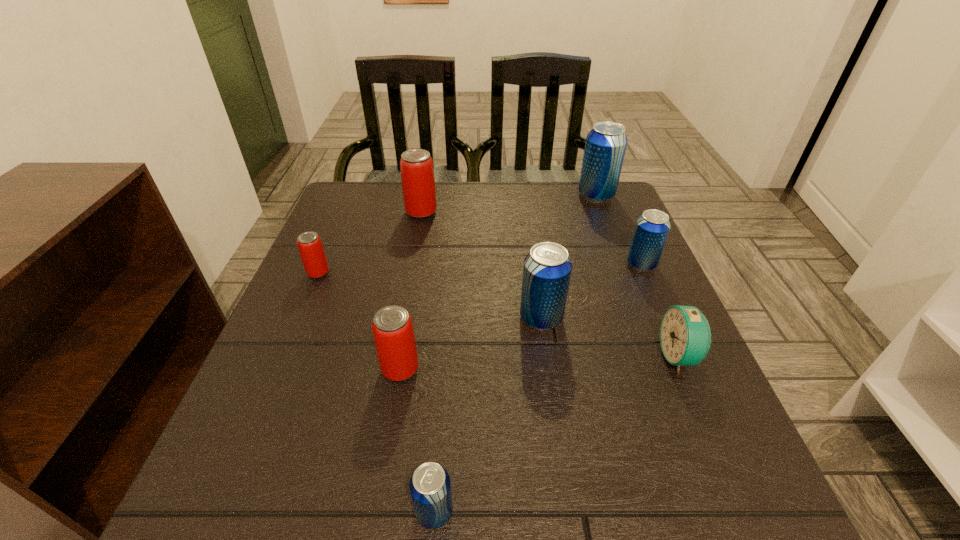
Where is `the leftmost beer can`? the leftmost beer can is located at coordinates (311, 250).

The height and width of the screenshot is (540, 960). Find the location of `the fifth object from right to left`. the fifth object from right to left is located at coordinates (430, 487).

Locate an element on the screen. This screenshot has width=960, height=540. the smallest blue beer can is located at coordinates (430, 487).

Locate an element on the screen. Image resolution: width=960 pixels, height=540 pixels. vacant position located 0.200m on the front of the farthest blue beer can is located at coordinates [617, 250].

The width and height of the screenshot is (960, 540). Find the location of `free space located 0.260m on the front of the biggest pink beer can`. free space located 0.260m on the front of the biggest pink beer can is located at coordinates (407, 288).

At what (x,y) coordinates should I click in order to perform the action: click on free spot located on the back of the fifth object from left to right. Please return your answer as a coordinate pair (x, y). Looking at the image, I should click on (527, 222).

The width and height of the screenshot is (960, 540). I want to click on free region located 0.140m on the back of the third biggest blue beer can, so click(x=623, y=222).

You are a GUI agent. You are given a task and a screenshot of the screen. Output one action in this format:
    pyautogui.click(x=<x>, y=<y>)
    Task: Click on the vacant space situated on the back of the second biggest pink beer can
    The height and width of the screenshot is (540, 960).
    Given the screenshot: What is the action you would take?
    pyautogui.click(x=412, y=301)

Find the location of a particular element. free space located on the front-facing side of the alarm clock is located at coordinates (553, 356).

You are a GUI agent. You are given a task and a screenshot of the screen. Output one action in this format:
    pyautogui.click(x=<x>, y=<y>)
    Task: Click on the free location located on the front-facing side of the alarm clock
    The width and height of the screenshot is (960, 540).
    Given the screenshot: What is the action you would take?
    pyautogui.click(x=531, y=356)